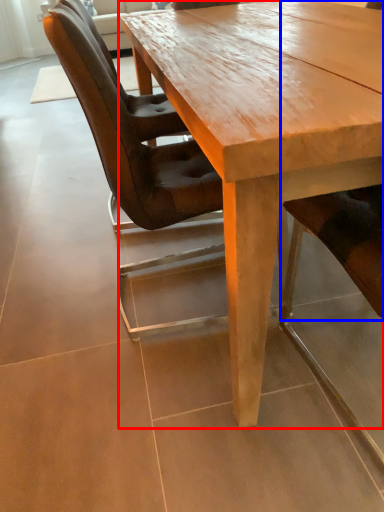
Question: Which object is further to the camera taking this photo, coffee table (highlighted by a red box) or chair (highlighted by a blue box)?

Choices:
 (A) coffee table
 (B) chair

Answer: (A)